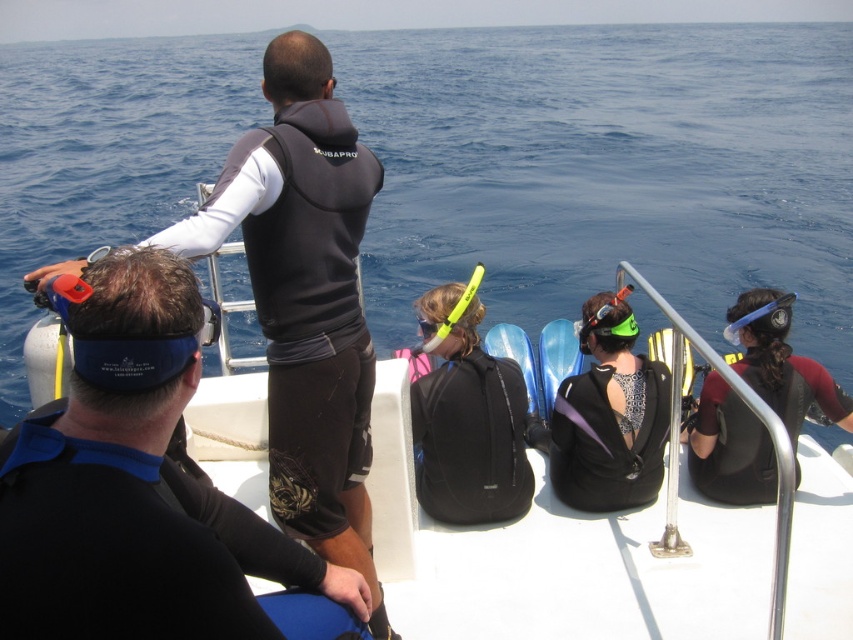
Question: Which object is positioned closest to the black matte backpack at center?

Choices:
 (A) blue water at upper center
 (B) clear plastic goggles at center
 (C) black matte boat at center
 (D) black matte wetsuit at upper center

Answer: (B)

Question: Can you confirm if matte black wetsuit at center is positioned to the left of clear plastic goggles at center?

Choices:
 (A) yes
 (B) no

Answer: (B)

Question: Which point is farther to the camera?

Choices:
 (A) blue water at upper center
 (B) black matte wetsuit at right
 (C) black matte wetsuit at upper center

Answer: (A)

Question: Does black matte backpack at center have a greater width compared to clear plastic goggles at center?

Choices:
 (A) yes
 (B) no

Answer: (A)

Question: Can you confirm if black matte boat at center is positioned above black matte backpack at center?

Choices:
 (A) yes
 (B) no

Answer: (B)

Question: Which point is farther to the camera?

Choices:
 (A) black matte backpack at center
 (B) clear plastic goggles at center

Answer: (B)